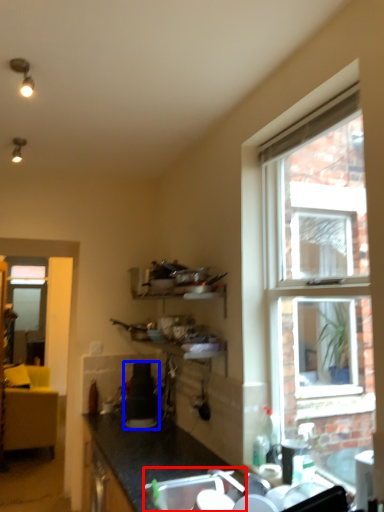
Question: Which object appears farthest to the camera in this image, sink (highlighted by a red box) or appliance (highlighted by a blue box)?

Choices:
 (A) sink
 (B) appliance

Answer: (B)